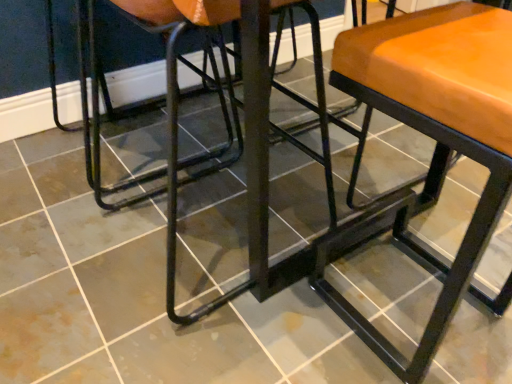
Identify the location of vacant space positioned to the left of matte orange cushioned stool at center. (287, 331).